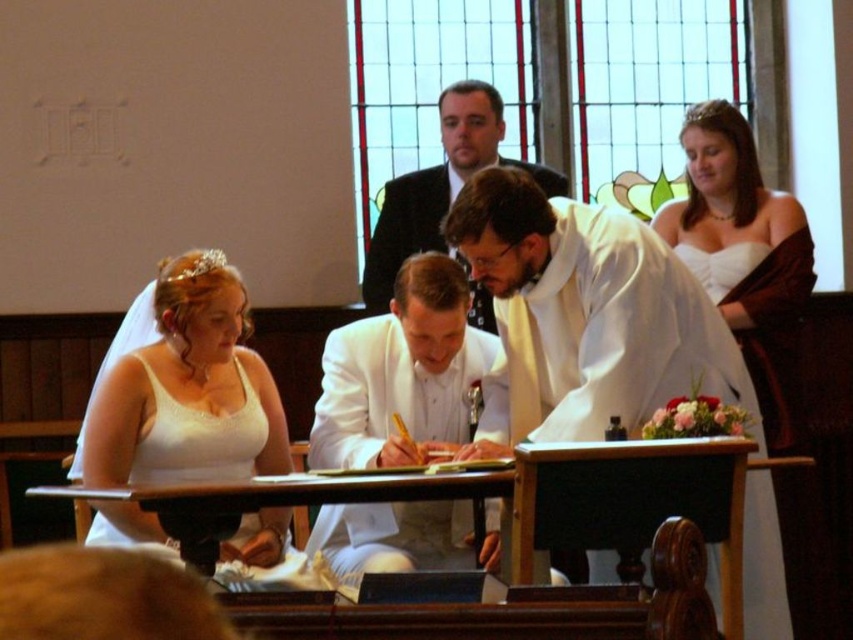
In the scene shown: You are a photographer standing at the camera position. You need to capture a closeup shot of the white satin suit at center. Given that your camera has a minimum focusing distance of 2 meters, can you take the photo without moving closer?

The white satin suit at center is 32.47 meters away from camera, so yes, you can take the photo without moving closer since it is well beyond the 2 meter minimum focusing distance.

You are a photographer positioned at the center of the room. You need to capture a photo of the white satin dress at left. According to the coordinates provided, in which direction should you move to frame the dress properly?

The white satin dress at left is located at point 0.609 on the x and 0.222 on the y. Since you are at the center, which is 0.5 on both axes, you should move slightly to the right and forward to align with the dress.

You are standing in the church and want to walk directly to the white satin suit at center. According to the coordinates provided, in which direction should you move relative to your current position if you are facing the stained glass windows?

Since the white satin suit at center is located at coordinates approximately 0.584 on the x axis and 0.470 on the y axis, you should move forward towards the center of the room while slightly to the right to reach it.